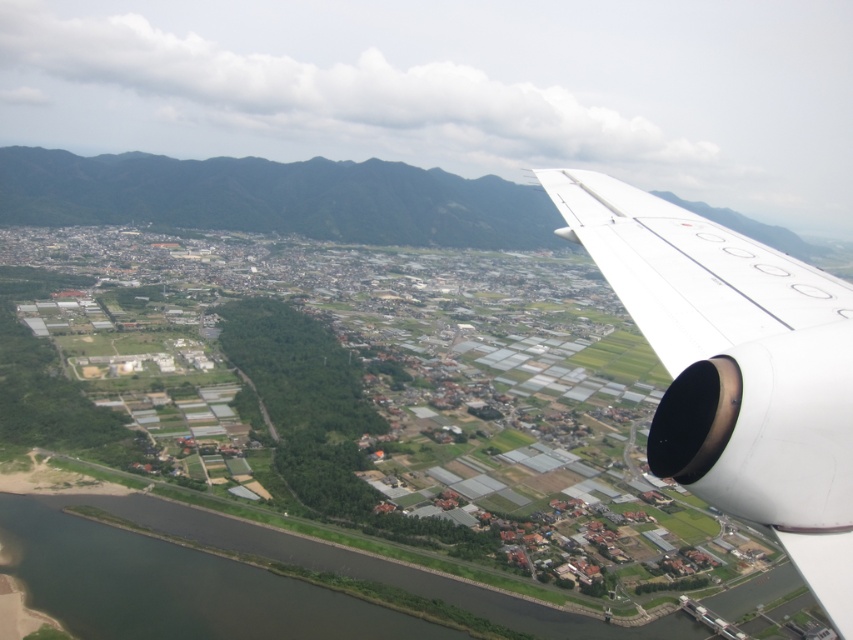
You are a passenger sitting near the window and notice two white matte wings in the view outside. Which one is closer to you, the white matte airplane wing at right or the white matte wing at upper right?

The white matte airplane wing at right is closer to you because it is in front of the white matte wing at upper right.

You are a passenger sitting at the window seat of an airplane. You notice a point marked at coordinates (x=735, y=369) on your window. Based on the scene described, what object is located at that point?

The point at coordinates (x=735, y=369) corresponds to the white matte airplane wing at right.

Looking at this image, you are a passenger seated near the window and want to take a photo of the landscape below. You notice two white matte wings in your view. Which of the two white matte wings, the white matte airplane wing at right or the white matte wing at upper right, is wider in your current view?

The white matte airplane wing at right is wider than the white matte wing at upper right according to the description.